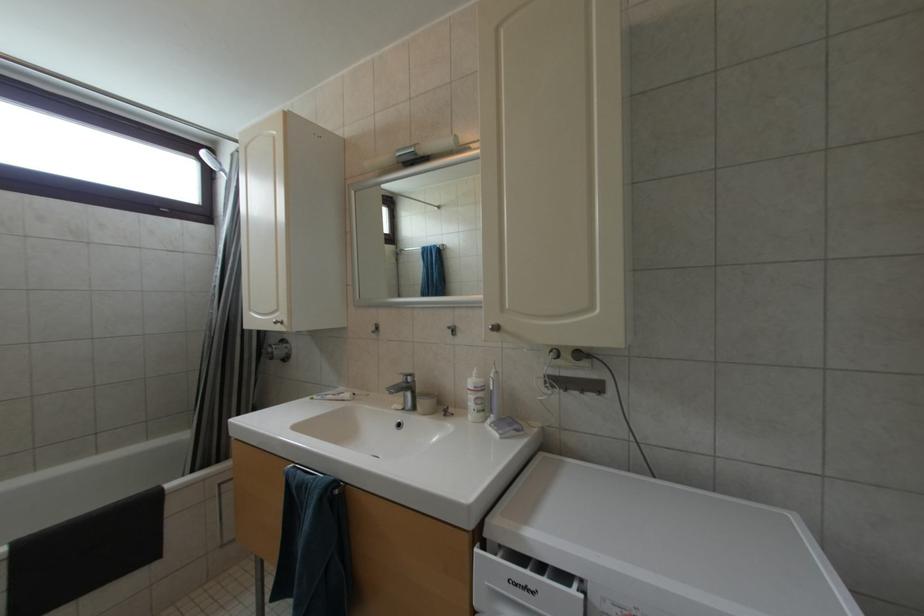
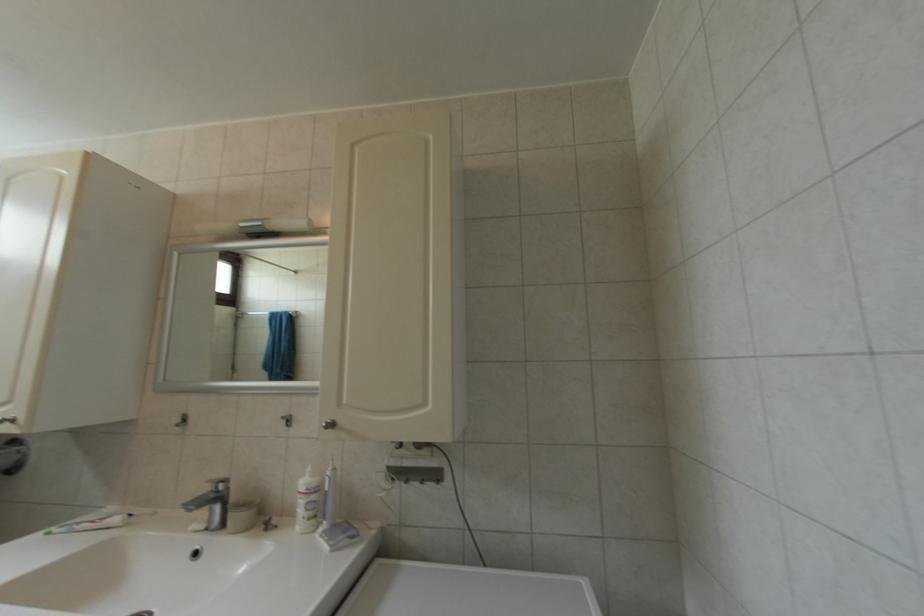
Question: The camera is either moving clockwise (left) or counter-clockwise (right) around the object. The first image is from the beginning of the video and the second image is from the end. Is the camera moving left or right when shooting the video?

Choices:
 (A) Left
 (B) Right

Answer: (A)